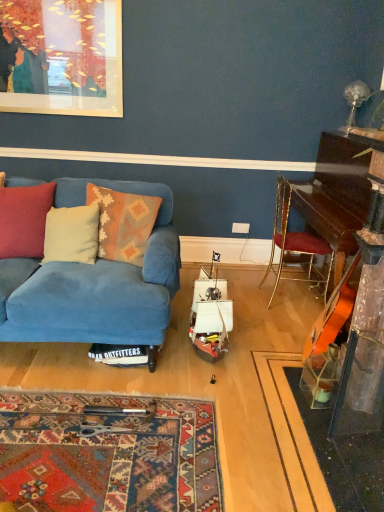
Question: From the image's perspective, is white plastic power outlet at center located beneath beige fabric pillow at left, which ranks as the 2th pillow in left-to-right order?

Choices:
 (A) no
 (B) yes

Answer: (A)

Question: Can you see white plastic power outlet at center touching beige fabric pillow at left, which ranks as the 2th pillow in left-to-right order?

Choices:
 (A) no
 (B) yes

Answer: (A)

Question: From a real-world perspective, is white plastic power outlet at center physically below beige fabric pillow at left, which ranks as the 2th pillow in left-to-right order?

Choices:
 (A) no
 (B) yes

Answer: (B)

Question: Can you confirm if white plastic power outlet at center is shorter than beige fabric pillow at left, which is the second pillow in right-to-left order?

Choices:
 (A) no
 (B) yes

Answer: (B)

Question: Can we say white plastic power outlet at center lies outside beige fabric pillow at left, which is the second pillow in right-to-left order?

Choices:
 (A) yes
 (B) no

Answer: (A)

Question: Is shiny dark wood piano at right in front of or behind white plastic power outlet at center in the image?

Choices:
 (A) behind
 (B) front

Answer: (B)

Question: From a real-world perspective, is shiny dark wood piano at right positioned above or below white plastic power outlet at center?

Choices:
 (A) above
 (B) below

Answer: (A)

Question: Is shiny dark wood piano at right bigger or smaller than white plastic power outlet at center?

Choices:
 (A) small
 (B) big

Answer: (B)

Question: From their relative heights in the image, would you say shiny dark wood piano at right is taller or shorter than white plastic power outlet at center?

Choices:
 (A) short
 (B) tall

Answer: (B)

Question: From the image's perspective, is white plastic power outlet at center positioned above or below blue fabric couch at left?

Choices:
 (A) above
 (B) below

Answer: (A)

Question: In terms of width, does white plastic power outlet at center look wider or thinner when compared to blue fabric couch at left?

Choices:
 (A) thin
 (B) wide

Answer: (A)

Question: From a real-world perspective, is white plastic power outlet at center positioned above or below blue fabric couch at left?

Choices:
 (A) below
 (B) above

Answer: (A)

Question: Is white plastic power outlet at center in front of or behind blue fabric couch at left in the image?

Choices:
 (A) behind
 (B) front

Answer: (A)

Question: Considering the relative positions of white plastic power outlet at center and shiny dark wood piano at right in the image provided, is white plastic power outlet at center to the left or to the right of shiny dark wood piano at right?

Choices:
 (A) right
 (B) left

Answer: (B)

Question: Relative to shiny dark wood piano at right, is white plastic power outlet at center in front or behind?

Choices:
 (A) front
 (B) behind

Answer: (B)